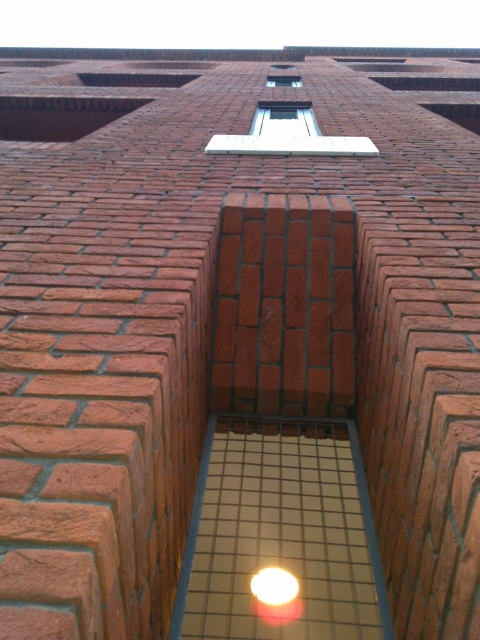
You are an architect reviewing a design for a brick wall with two clear glass windows. The scene shows a brick wall with a unique staggered pattern creating a wave effect. There is a rectangular opening framed by metal bars with a bright light inside. You need to determine if the larger clear glass window at center will allow more natural light into the room compared to the smaller clear glass window at upper center. Based on their sizes, which window would let in more light?

The clear glass window at center is bigger than the clear glass window at upper center, so it would allow more natural light into the room compared to the smaller window.

You are an architect designing a new building and want to incorporate similar staggered brick patterns. You notice two clear glass windows in the image. Which window, the clear glass window at center or the clear glass window at upper center, has a wider opening?

The clear glass window at center has a wider opening than the clear glass window at upper center because its width is larger according to the description.

You are standing in front of the brick wall and want to locate the clear glass window at center and the clear glass window at upper center. Which one is positioned higher up on the wall?

The clear glass window at upper center is positioned higher up on the wall than the clear glass window at center.